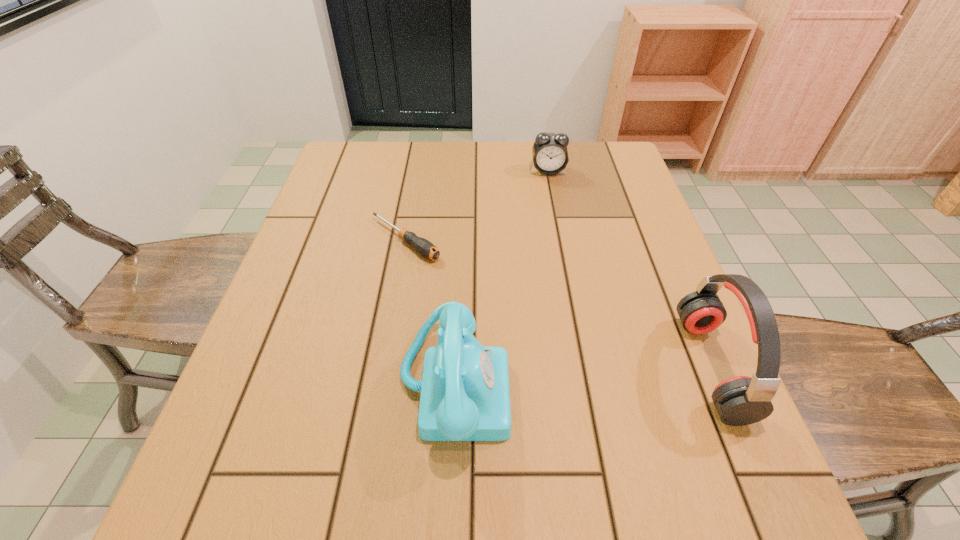
You are a GUI agent. You are given a task and a screenshot of the screen. Output one action in this format:
    pyautogui.click(x=<x>, y=<y>)
    Task: Click on the vacant space on the desktop that is between the telephone and the tallest object and is positioned at the tip of the shortest object
    This screenshot has height=540, width=960.
    Given the screenshot: What is the action you would take?
    pyautogui.click(x=602, y=374)

Find the location of `vacant space on the desktop that is between the telephone and the earphone and is positioned on the front side of the second shortest object`. vacant space on the desktop that is between the telephone and the earphone and is positioned on the front side of the second shortest object is located at coordinates (583, 376).